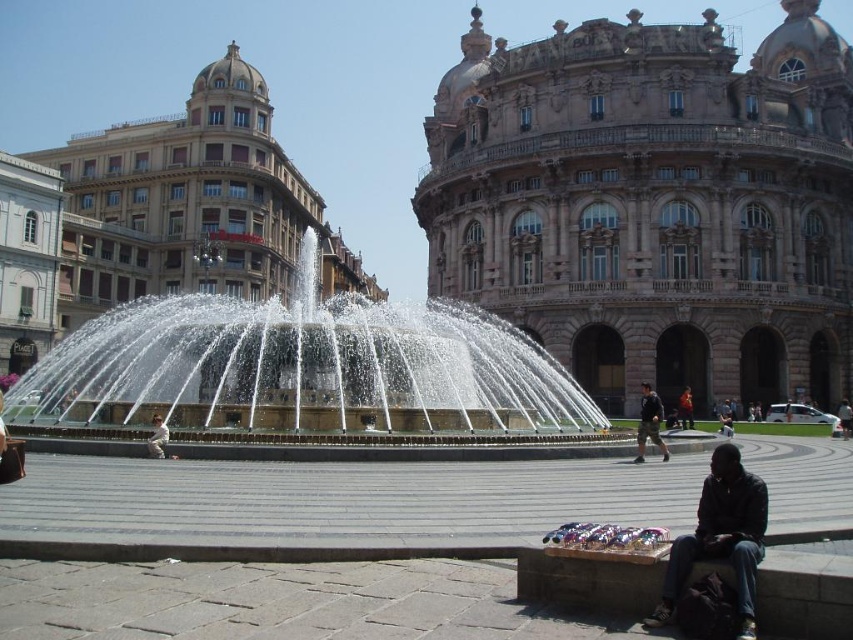
Question: Observing the image, what is the correct spatial positioning of brown stone building at center in reference to dark brown leather jacket at center?

Choices:
 (A) below
 (B) above

Answer: (B)

Question: Which of the following is the farthest from the observer?

Choices:
 (A) (154, 413)
 (B) (636, 436)
 (C) (544, 330)
 (D) (677, 397)

Answer: (C)

Question: Among these points, which one is nearest to the camera?

Choices:
 (A) [x=291, y=196]
 (B) [x=816, y=376]
 (C) [x=850, y=417]
 (D) [x=682, y=422]

Answer: (D)

Question: Does brown stone palace at upper center have a larger size compared to brown stone building at center?

Choices:
 (A) yes
 (B) no

Answer: (B)

Question: Which of the following is the farthest from the observer?

Choices:
 (A) white cotton shirt at center
 (B) dark brown leather jacket at lower right

Answer: (A)

Question: Can you confirm if watermattefountain at center is wider than white cotton shirt at center?

Choices:
 (A) no
 (B) yes

Answer: (B)